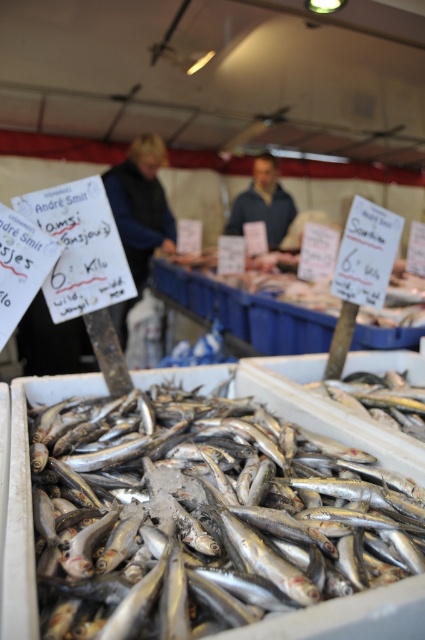
How distant is silvery metallic fish at center from shiny silver fish at center?

The distance of silvery metallic fish at center from shiny silver fish at center is 22.57 inches.

Image resolution: width=425 pixels, height=640 pixels. Identify the location of silvery metallic fish at center. (204, 509).